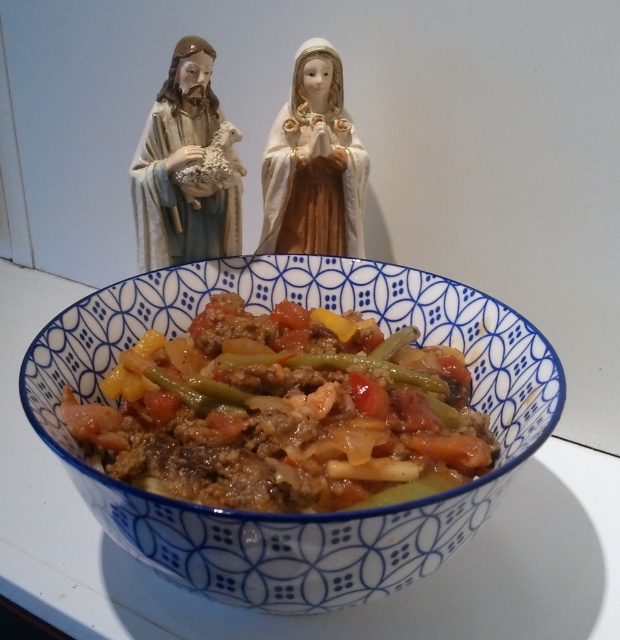
Which is behind, point (502, 413) or point (188, 177)?

Point (188, 177)

Describe the element at coordinates (296, 515) in the screenshot. The width and height of the screenshot is (620, 640). I see `blue ceramic bowl at center` at that location.

Image resolution: width=620 pixels, height=640 pixels. In order to click on blue ceramic bowl at center in this screenshot , I will do `click(296, 515)`.

Does matte porcelain figurine at upper left appear on the left side of porcelain doll at upper center?

Correct, you'll find matte porcelain figurine at upper left to the left of porcelain doll at upper center.

Between matte porcelain figurine at upper left and porcelain doll at upper center, which one has more height?

matte porcelain figurine at upper left

Who is more forward, (169,244) or (308,97)?

Point (169,244) is in front.

In order to click on matte porcelain figurine at upper left in this screenshot , I will do `click(187, 168)`.

Does blue ceramic bowl at center have a greater height compared to porcelain doll at upper center?

Correct, blue ceramic bowl at center is much taller as porcelain doll at upper center.

From the picture: Is blue ceramic bowl at center above porcelain doll at upper center?

Incorrect, blue ceramic bowl at center is not positioned above porcelain doll at upper center.

Is point (547, 404) farther from viewer compared to point (322, 52)?

That is False.

This screenshot has width=620, height=640. In order to click on blue ceramic bowl at center in this screenshot , I will do `click(296, 515)`.